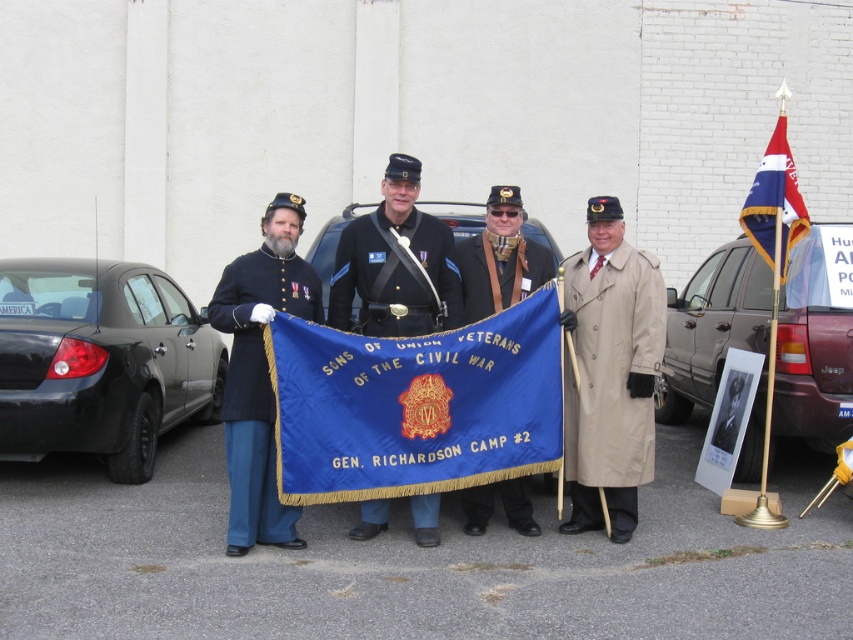
You are a photographer at the Civil War reenactment event. You need to capture a clear photo of the blue fabric flag at center without the black matte sedan at left blocking it. Is the flag positioned in a way that allows this?

Yes, the blue fabric flag at center is in front of the black matte sedan at left, so it is not blocked by the sedan and can be photographed clearly.

You are a photographer trying to capture the blue fabric flag at center and the black matte sedan at left in a single shot. Based on their positions, which object is closer to the camera?

The blue fabric flag at center is positioned under the black matte sedan at left, so the flag is closer to the camera than the sedan.

You are a photographer at the event and need to capture the blue fabric flag at center and the black matte sedan at left in a single shot. Given their sizes, which object will appear smaller in the photo?

The blue fabric flag at center will appear smaller in the photo because it has a smaller size compared to the black matte sedan at left.